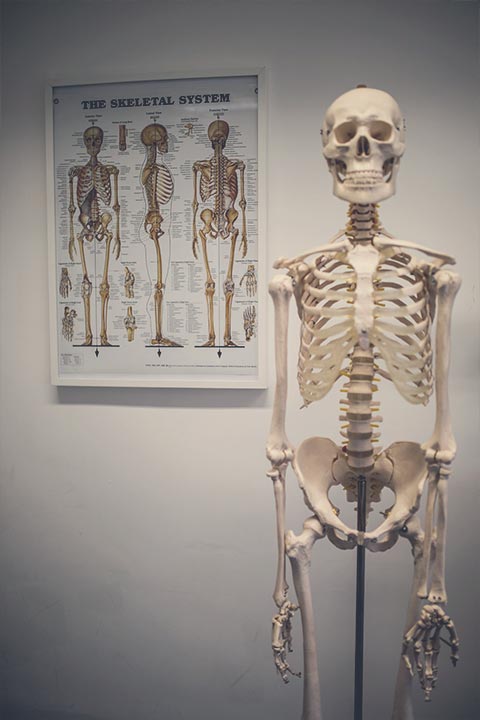
Where is `skeleton model`? skeleton model is located at coordinates (367, 354).